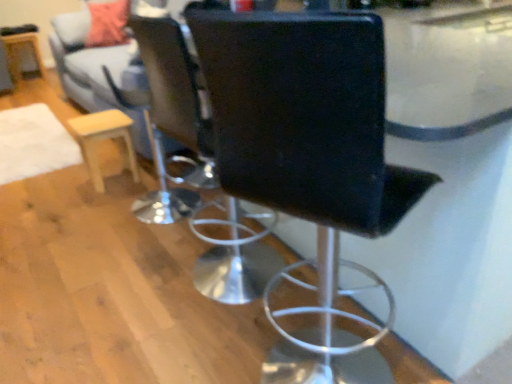
The width and height of the screenshot is (512, 384). What are the coordinates of `vacant area situated below light wood/finely finished stool at left (from a real-world perspective)` in the screenshot? It's located at (114, 180).